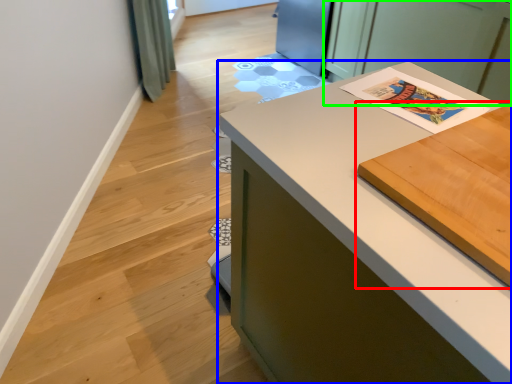
Question: Based on their relative distances, which object is farther from table (highlighted by a red box)? Choose from countertop (highlighted by a blue box) and cabinetry (highlighted by a green box).

Choices:
 (A) countertop
 (B) cabinetry

Answer: (B)